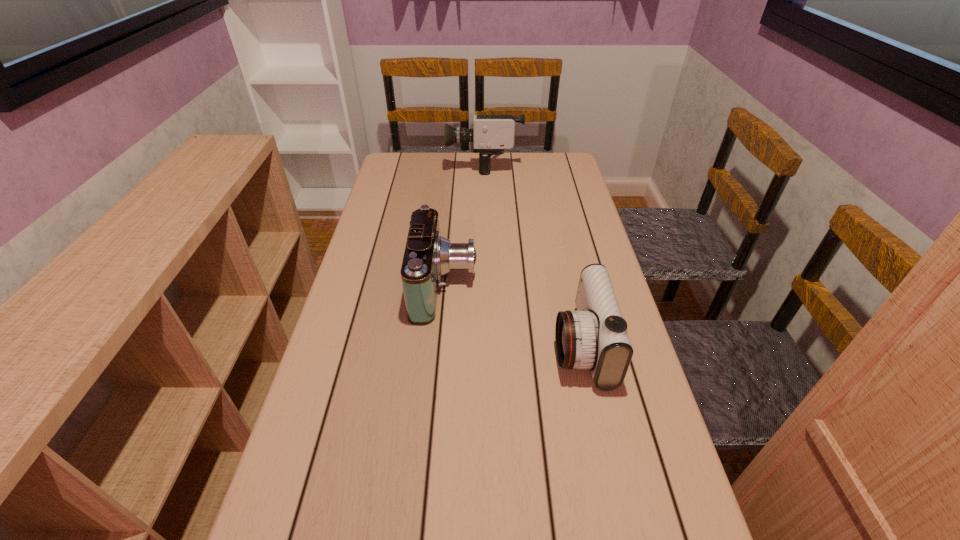
You are a GUI agent. You are given a task and a screenshot of the screen. Output one action in this format:
    pyautogui.click(x=<x>, y=<y>)
    Task: Click on the farthest camcorder
    The width and height of the screenshot is (960, 540).
    Given the screenshot: What is the action you would take?
    pyautogui.click(x=491, y=134)

This screenshot has width=960, height=540. I want to click on the tallest object, so click(491, 134).

This screenshot has height=540, width=960. What are the coordinates of `the rightmost camcorder` in the screenshot? It's located at (595, 337).

This screenshot has width=960, height=540. What are the coordinates of `blank space located 0.180m on the recording direction of the farthest camcorder` in the screenshot? It's located at (402, 165).

Find the location of a particular element. This screenshot has width=960, height=540. vacant region located 0.240m on the recording direction of the farthest camcorder is located at coordinates 387,165.

Where is `vacant space located 0.060m on the recording direction of the farthest camcorder`? The height and width of the screenshot is (540, 960). vacant space located 0.060m on the recording direction of the farthest camcorder is located at coordinates (433, 165).

Identify the location of vacant space located on the surface of the rightmost camcorder. The width and height of the screenshot is (960, 540). (437, 346).

This screenshot has height=540, width=960. I want to click on vacant space located on the surface of the rightmost camcorder, so click(x=508, y=346).

Locate an element on the screen. This screenshot has height=540, width=960. vacant space situated 0.350m on the surface of the rightmost camcorder is located at coordinates (408, 346).

You are a GUI agent. You are given a task and a screenshot of the screen. Output one action in this format:
    pyautogui.click(x=<x>, y=<y>)
    Task: Click on the object present at the far edge
    
    Given the screenshot: What is the action you would take?
    [491, 134]